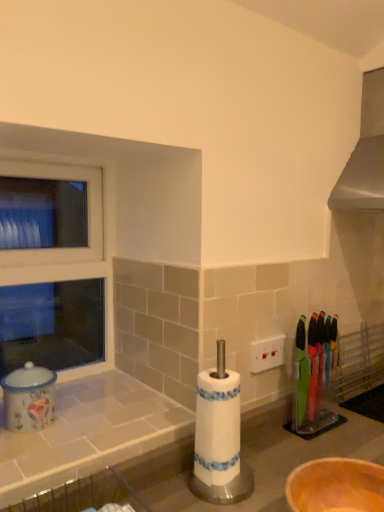
Where is `vacant region to the right of matte ceramic coffee canister at left`? The width and height of the screenshot is (384, 512). vacant region to the right of matte ceramic coffee canister at left is located at coordinates (104, 433).